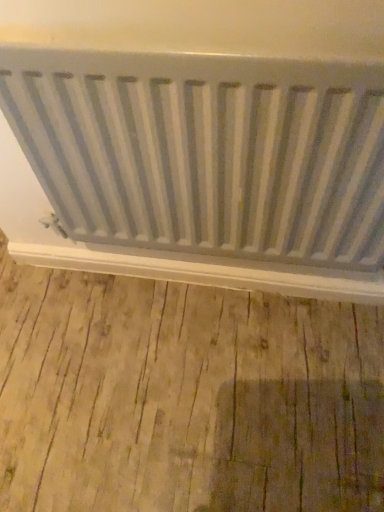
Identify the location of vacant space in front of white matte radiator at lower center. (199, 390).